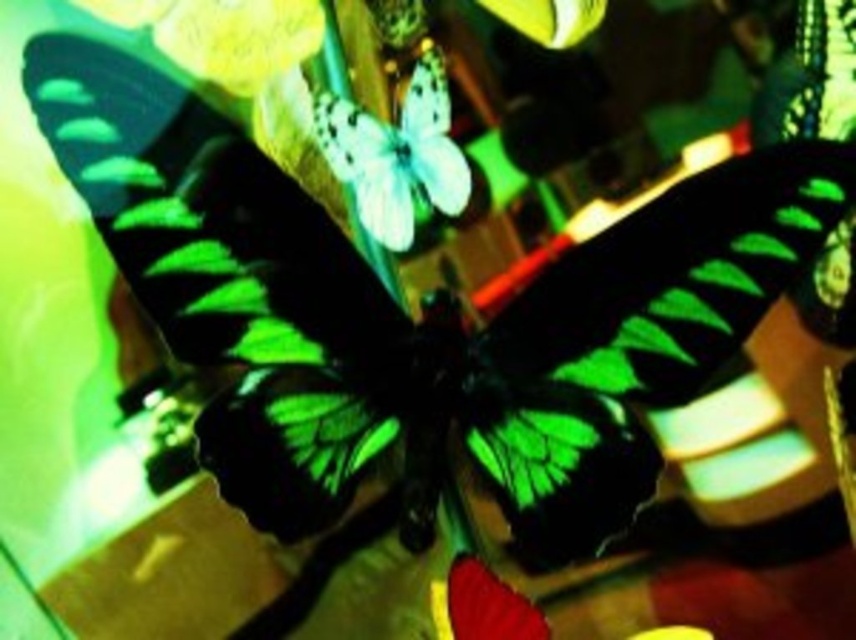
Between matte yellow flower at upper left and transparent glass vase at lower right, which one appears on the right side from the viewer's perspective?

transparent glass vase at lower right is more to the right.

Which is in front, point (275, 70) or point (839, 436)?

Positioned in front is point (275, 70).

At what (x,y) coordinates should I click in order to perform the action: click on matte yellow flower at upper left. Please return your answer as a coordinate pair (x, y). Image resolution: width=856 pixels, height=640 pixels. Looking at the image, I should click on (223, 35).

Can you confirm if white matte butterfly at center is smaller than transparent glass vase at lower right?

Actually, white matte butterfly at center might be larger than transparent glass vase at lower right.

Is white matte butterfly at center shorter than transparent glass vase at lower right?

No, white matte butterfly at center is not shorter than transparent glass vase at lower right.

Between point (339, 168) and point (849, 403), which one is positioned behind?

Positioned behind is point (849, 403).

This screenshot has width=856, height=640. I want to click on white matte butterfly at center, so click(396, 154).

Locate an element on the screen. white matte butterfly at center is located at coordinates pos(396,154).

Describe the element at coordinates (396, 154) in the screenshot. This screenshot has height=640, width=856. I see `white matte butterfly at center` at that location.

Image resolution: width=856 pixels, height=640 pixels. I want to click on white matte butterfly at center, so click(x=396, y=154).